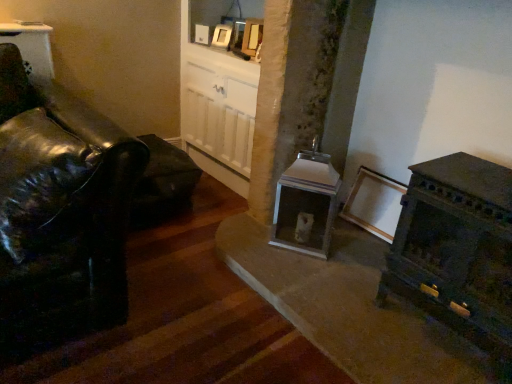
Question: From the image's perspective, relative to metallic silver fireplace at center, is white glossy picture frame at upper center above or below?

Choices:
 (A) above
 (B) below

Answer: (A)

Question: In the image, is white glossy picture frame at upper center on the left side or the right side of metallic silver fireplace at center?

Choices:
 (A) left
 (B) right

Answer: (A)

Question: Considering the positions of white glossy picture frame at upper center and metallic silver fireplace at center in the image, is white glossy picture frame at upper center taller or shorter than metallic silver fireplace at center?

Choices:
 (A) short
 (B) tall

Answer: (A)

Question: Considering the positions of metallic silver fireplace at center and white glossy picture frame at upper center in the image, is metallic silver fireplace at center bigger or smaller than white glossy picture frame at upper center?

Choices:
 (A) big
 (B) small

Answer: (A)

Question: Is metallic silver fireplace at center spatially inside white glossy picture frame at upper center, or outside of it?

Choices:
 (A) inside
 (B) outside

Answer: (B)

Question: Considering the positions of point (314, 170) and point (223, 43), is point (314, 170) closer or farther from the camera than point (223, 43)?

Choices:
 (A) closer
 (B) farther

Answer: (A)

Question: Is metallic silver fireplace at center taller or shorter than white glossy picture frame at upper center?

Choices:
 (A) short
 (B) tall

Answer: (B)